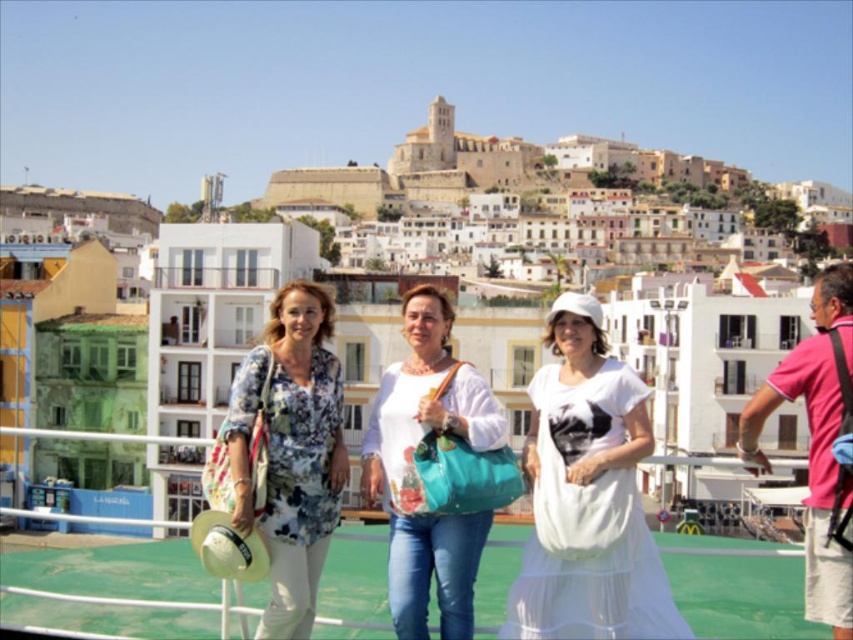
Does point (577, 490) come farther from viewer compared to point (363, 465)?

No, it is in front of (363, 465).

Does point (605, 604) come in front of point (408, 637)?

Yes, it is.

Locate an element on the screen. Image resolution: width=853 pixels, height=640 pixels. white cotton dress at center is located at coordinates (589, 496).

Is white matte bag at center wider than pink cotton shirt at right?

In fact, white matte bag at center might be narrower than pink cotton shirt at right.

Does white matte bag at center come behind pink cotton shirt at right?

Yes, white matte bag at center is further from the viewer.

The width and height of the screenshot is (853, 640). What are the coordinates of `white matte bag at center` in the screenshot? It's located at (415, 474).

You are a GUI agent. You are given a task and a screenshot of the screen. Output one action in this format:
    pyautogui.click(x=<x>, y=<y>)
    Task: Click on the white matte bag at center
    Image resolution: width=853 pixels, height=640 pixels.
    Given the screenshot: What is the action you would take?
    pyautogui.click(x=415, y=474)

Can you confirm if floral print blouse at center is positioned below white matte bag at center?

Indeed, floral print blouse at center is positioned under white matte bag at center.

Is floral print blouse at center to the right of white matte bag at center from the viewer's perspective?

No, floral print blouse at center is not to the right of white matte bag at center.

Measure the distance between point (331, 480) and camera.

A distance of 153.36 feet exists between point (331, 480) and camera.

Where is `floral print blouse at center`? The width and height of the screenshot is (853, 640). floral print blouse at center is located at coordinates (289, 451).